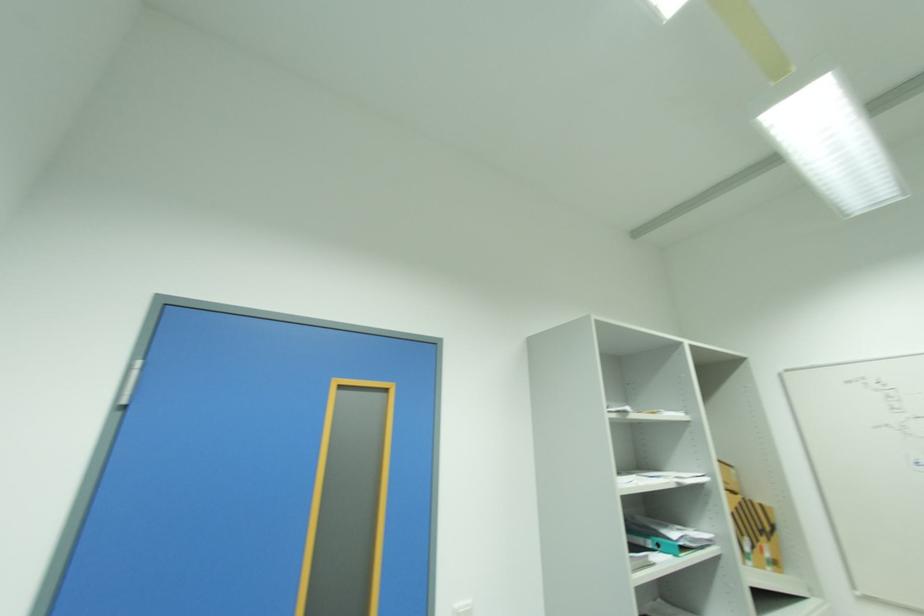
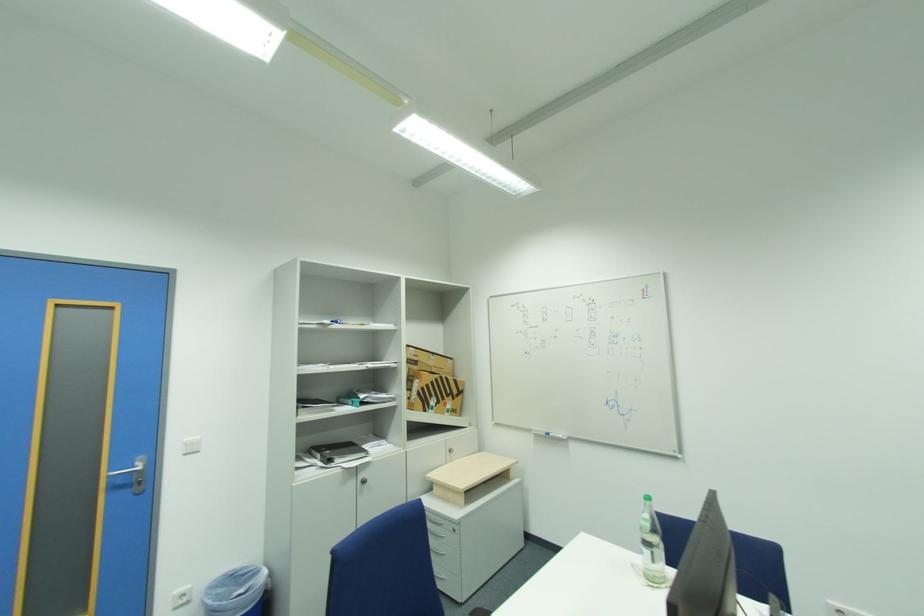
What movement of the cameraman would produce the second image?

The movement direction of the cameraman is right, backward.